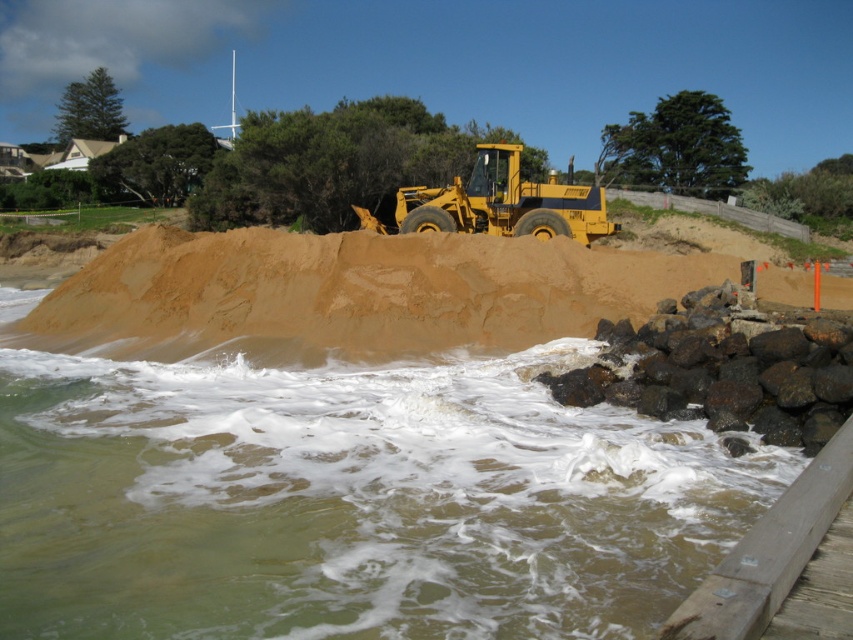
Between brown sandy water at lower left and yellow metallic tractor at center, which one appears on the right side from the viewer's perspective?

From the viewer's perspective, yellow metallic tractor at center appears more on the right side.

The height and width of the screenshot is (640, 853). Describe the element at coordinates (350, 499) in the screenshot. I see `brown sandy water at lower left` at that location.

Locate an element on the screen. The height and width of the screenshot is (640, 853). brown sandy water at lower left is located at coordinates (350, 499).